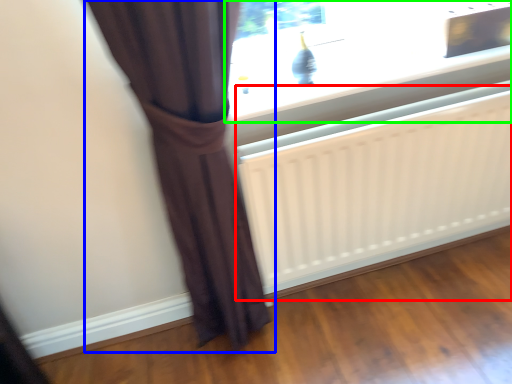
Question: Which object is positioned farthest from radiator (highlighted by a red box)? Select from curtain (highlighted by a blue box) and window (highlighted by a green box).

Choices:
 (A) curtain
 (B) window

Answer: (A)